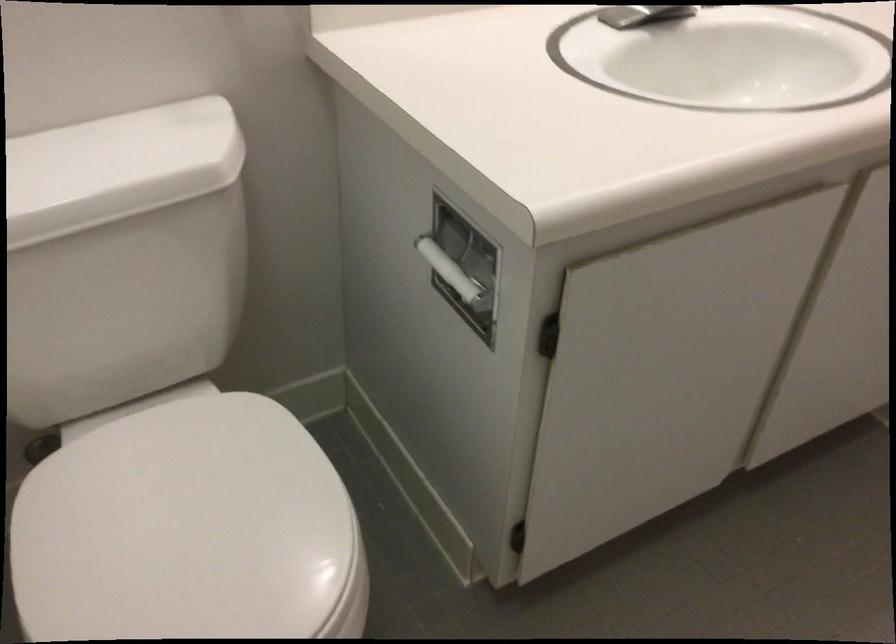
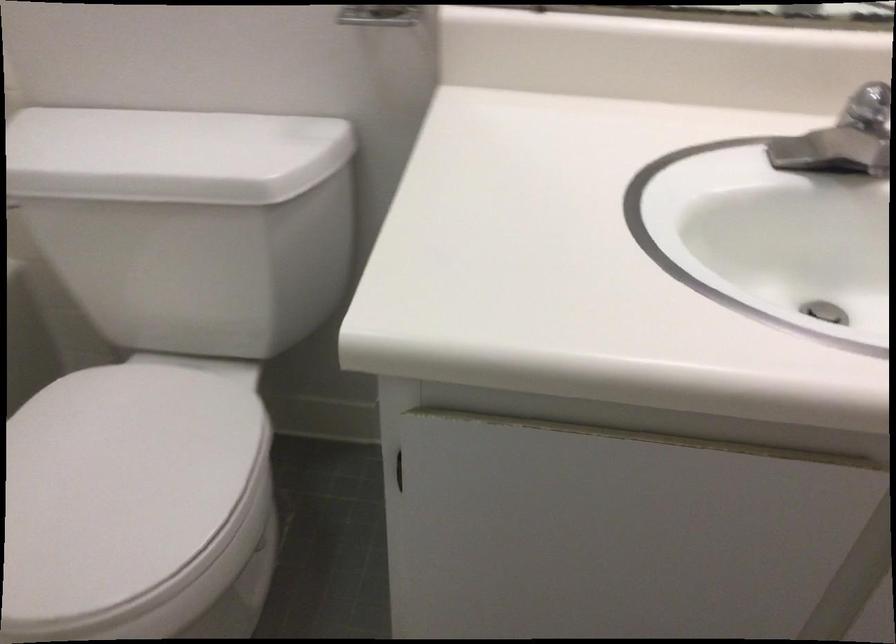
Question: The camera is either moving clockwise (left) or counter-clockwise (right) around the object. The first image is from the beginning of the video and the second image is from the end. Is the camera moving left or right when shooting the video?

Choices:
 (A) Left
 (B) Right

Answer: (B)